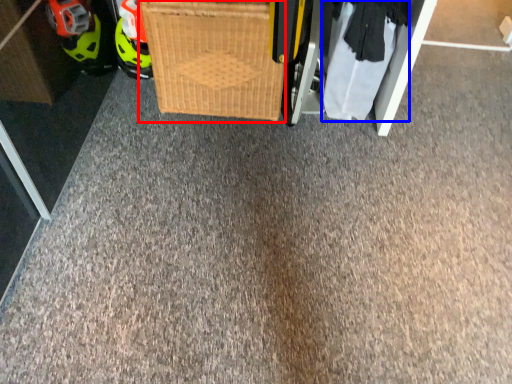
Question: Which point is further to the camera, basket (highlighted by a red box) or clothing (highlighted by a blue box)?

Choices:
 (A) basket
 (B) clothing

Answer: (B)